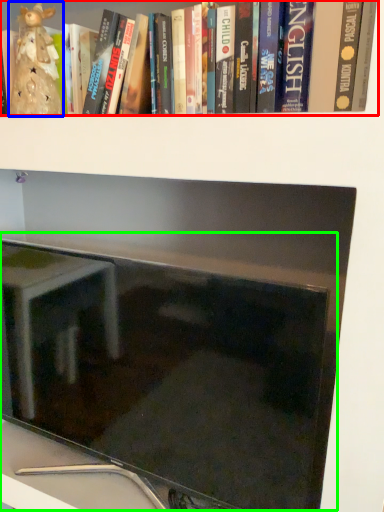
Question: Which is farther away from book (highlighted by a red box)? figurine (highlighted by a blue box) or computer monitor (highlighted by a green box)?

Choices:
 (A) figurine
 (B) computer monitor

Answer: (B)